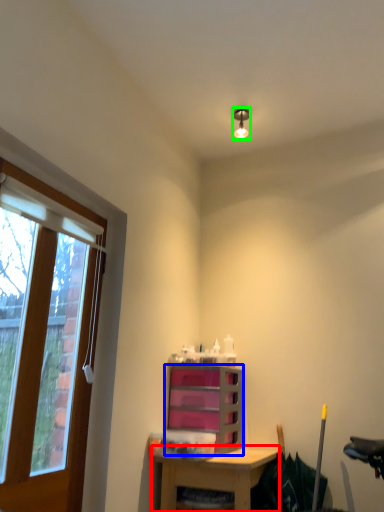
Question: Estimate the real-world distances between objects in this image. Which object is farther from desk (highlighted by a red box), cabinetry (highlighted by a blue box) or light fixture (highlighted by a green box)?

Choices:
 (A) cabinetry
 (B) light fixture

Answer: (B)